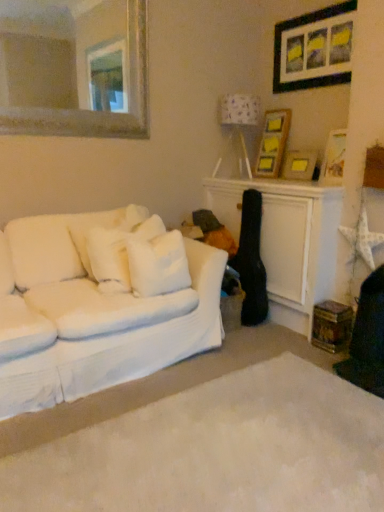
Question: Is point (137, 250) closer or farther from the camera than point (127, 473)?

Choices:
 (A) farther
 (B) closer

Answer: (A)

Question: Is white soft pillow at center, the second pillow positioned from the left, inside the boundaries of white soft carpet at lower center, or outside?

Choices:
 (A) outside
 (B) inside

Answer: (A)

Question: Estimate the real-world distances between objects in this image. Which object is closer to the wooden picture frame at upper right, positioned as the second picture frame in bottom-to-top order?

Choices:
 (A) wooden picture frame at upper right, which is the 3th picture frame in bottom-to-top order
 (B) white soft pillow at center, the second pillow positioned from the left
 (C) wooden swivel chair at lower right
 (D) white soft carpet at lower center
 (E) gold-framed mirror at upper left

Answer: (A)

Question: Based on their relative distances, which object is farther from the white soft carpet at lower center?

Choices:
 (A) white soft pillow at left, marked as the second pillow in a right-to-left arrangement
 (B) wooden picture frame at upper right, which ranks as the third picture frame in top-to-bottom order
 (C) gold-framed mirror at upper left
 (D) white fabric lampshade at upper right
 (E) white soft pillow at center, the second pillow positioned from the left

Answer: (C)